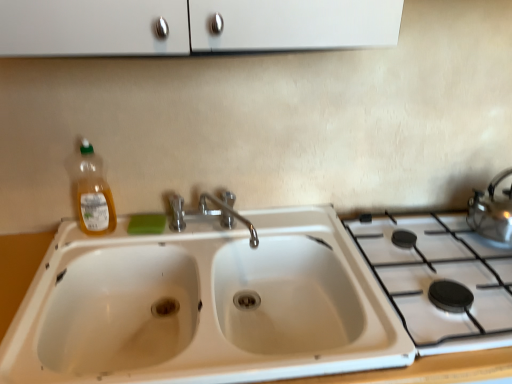
This screenshot has height=384, width=512. I want to click on unoccupied area in front of translucent plastic bottle at left, so click(76, 254).